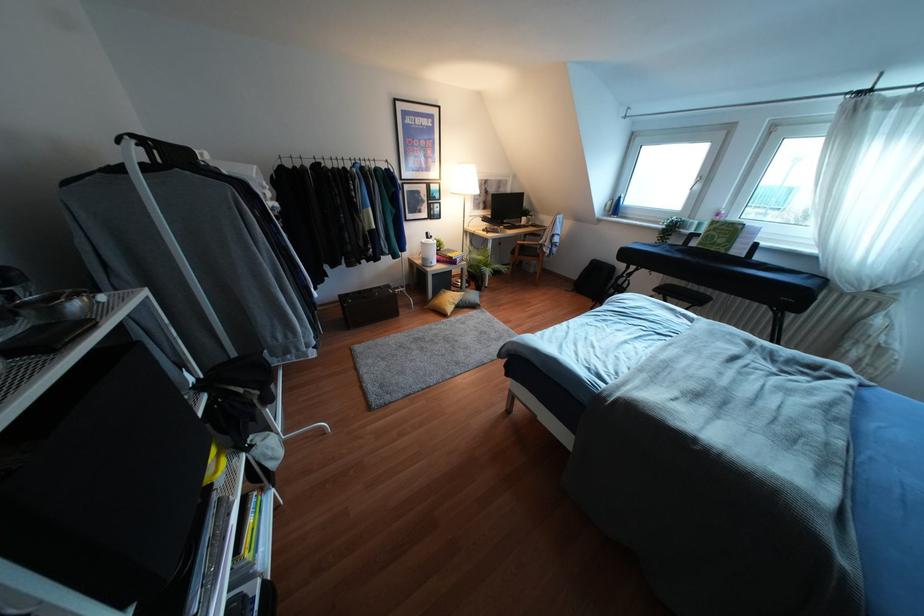
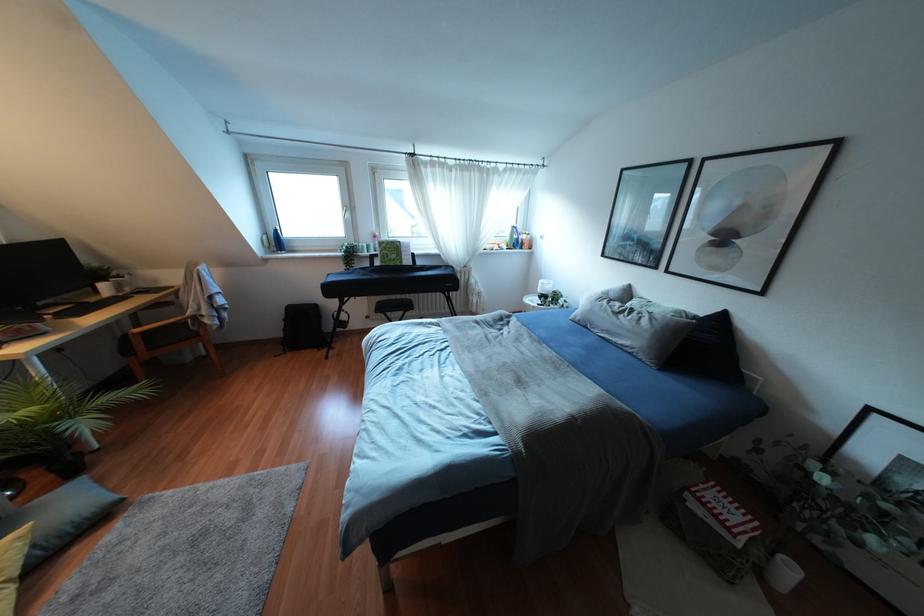
Where in the second image is the point corresponding to pixel 697 187 from the first image?

(346, 215)